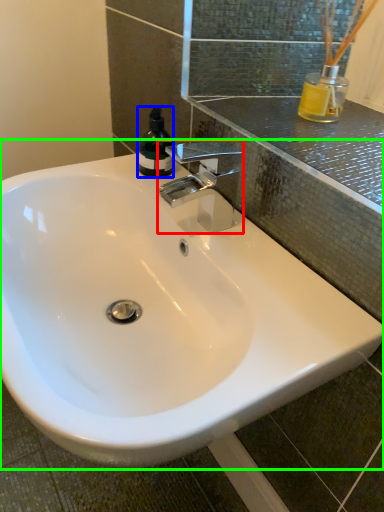
Question: Considering the real-world distances, which object is closest to tap (highlighted by a red box)? bottle (highlighted by a blue box) or sink (highlighted by a green box).

Choices:
 (A) bottle
 (B) sink

Answer: (A)